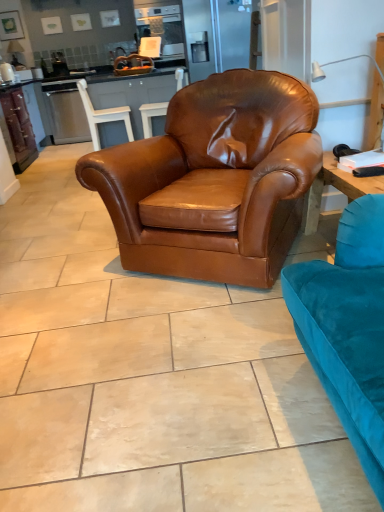
This screenshot has height=512, width=384. Identify the location of brown leather armchair at center, which is counted as the 1th chair, starting from the back. (151, 115).

Where is `satin silver oven at upper center`? This screenshot has height=512, width=384. satin silver oven at upper center is located at coordinates (162, 25).

Based on the photo, measure the distance between point (123, 113) and camera.

Point (123, 113) is 13.84 feet from camera.

This screenshot has height=512, width=384. I want to click on brown leather armchair at center, which is counted as the third chair, starting from the back, so click(x=214, y=180).

Locate an element on the screen. brown leather armchair at center, which is counted as the 3th chair, starting from the front is located at coordinates point(151,115).

Does brown leather armchair at center, which ranks as the 1th chair in front-to-back order, have a greater width compared to brown leather armchair at center, which is counted as the 3th chair, starting from the front?

Yes.

Is brown leather armchair at center, which is counted as the third chair, starting from the back, oriented towards brown leather armchair at center, which is counted as the 3th chair, starting from the front?

No, brown leather armchair at center, which is counted as the third chair, starting from the back, is not oriented towards brown leather armchair at center, which is counted as the 3th chair, starting from the front.

From the image's perspective, is brown leather armchair at center, which ranks as the 1th chair in front-to-back order, above or below brown leather armchair at center, which is counted as the 3th chair, starting from the front?

From the image's perspective, brown leather armchair at center, which ranks as the 1th chair in front-to-back order, appears below brown leather armchair at center, which is counted as the 3th chair, starting from the front.

How different are the orientations of brown leather armchair at center, which is counted as the third chair, starting from the back, and brown leather armchair at center, which is counted as the 1th chair, starting from the back, in degrees?

58.7 degrees.

Between satin silver oven at upper center and brown leather armchair at center, which ranks as the 1th chair in front-to-back order, which one has more height?

brown leather armchair at center, which ranks as the 1th chair in front-to-back order, is taller.

Measure the distance from satin silver oven at upper center to brown leather armchair at center, which is counted as the third chair, starting from the back.

satin silver oven at upper center is 4.10 meters away from brown leather armchair at center, which is counted as the third chair, starting from the back.

Is point (145, 32) farther from camera compared to point (198, 202)?

Yes, point (145, 32) is behind point (198, 202).

Considering the sizes of objects satin silver oven at upper center and brown leather armchair at center, which is counted as the third chair, starting from the back, in the image provided, who is wider, satin silver oven at upper center or brown leather armchair at center, which is counted as the third chair, starting from the back,?

brown leather armchair at center, which is counted as the third chair, starting from the back.

Is brown leather armchair at center, which ranks as the 1th chair in front-to-back order, thinner than brown leather armchair at center, the 2th chair viewed from the front?

In fact, brown leather armchair at center, which ranks as the 1th chair in front-to-back order, might be wider than brown leather armchair at center, the 2th chair viewed from the front.

From the picture: Does brown leather armchair at center, which is counted as the third chair, starting from the back, lie in front of brown leather armchair at center, which is the 2th chair in back-to-front order?

That is True.

Can you tell me how much brown leather armchair at center, which ranks as the 1th chair in front-to-back order, and brown leather armchair at center, which is the 2th chair in back-to-front order, differ in facing direction?

brown leather armchair at center, which ranks as the 1th chair in front-to-back order, and brown leather armchair at center, which is the 2th chair in back-to-front order, are facing 125 degrees away from each other.

Between brown leather armchair at center, which ranks as the 1th chair in front-to-back order, and brown leather armchair at center, the 2th chair viewed from the front, which one appears on the right side from the viewer's perspective?

Positioned to the right is brown leather armchair at center, which ranks as the 1th chair in front-to-back order.

Can you confirm if brown leather armchair at center, which is counted as the 1th chair, starting from the back, is wider than satin silver oven at upper center?

No.

Consider the image. Who is more distant, brown leather armchair at center, which is counted as the 3th chair, starting from the front, or satin silver oven at upper center?

satin silver oven at upper center is behind.

Is brown leather armchair at center, which is counted as the 3th chair, starting from the front, positioned beyond the bounds of satin silver oven at upper center?

Yes, brown leather armchair at center, which is counted as the 3th chair, starting from the front, is located beyond the bounds of satin silver oven at upper center.

Which is more distant, [144,127] or [178,24]?

The point [178,24] is farther from the camera.

Which is correct: brown leather armchair at center, which is the 2th chair in back-to-front order, is inside satin silver oven at upper center, or outside of it?

brown leather armchair at center, which is the 2th chair in back-to-front order, is spatially situated outside satin silver oven at upper center.

Are brown leather armchair at center, the 2th chair viewed from the front, and satin silver oven at upper center located far from each other?

Yes.

Is brown leather armchair at center, the 2th chair viewed from the front, oriented towards satin silver oven at upper center?

No, brown leather armchair at center, the 2th chair viewed from the front, is not facing towards satin silver oven at upper center.

Is brown leather armchair at center, which is counted as the 1th chair, starting from the back, next to brown leather armchair at center, which is counted as the third chair, starting from the back?

No, brown leather armchair at center, which is counted as the 1th chair, starting from the back, is not in contact with brown leather armchair at center, which is counted as the third chair, starting from the back.

Is point (165, 106) farther from viewer compared to point (200, 113)?

Yes, it is behind point (200, 113).

Which object is positioned more to the right, brown leather armchair at center, which is counted as the 3th chair, starting from the front, or brown leather armchair at center, which is counted as the third chair, starting from the back?

brown leather armchair at center, which is counted as the third chair, starting from the back, is more to the right.

From a real-world perspective, who is located higher, brown leather armchair at center, which is counted as the 1th chair, starting from the back, or brown leather armchair at center, which ranks as the 1th chair in front-to-back order?

From a 3D spatial view, brown leather armchair at center, which is counted as the 1th chair, starting from the back, is above.

Between point (178, 26) and point (93, 131), which one is positioned in front?

The point (93, 131) is more forward.

Which of these two, satin silver oven at upper center or brown leather armchair at center, the 2th chair viewed from the front, is wider?

satin silver oven at upper center.

From a real-world perspective, is satin silver oven at upper center on top of brown leather armchair at center, which is the 2th chair in back-to-front order?

Yes, from a real-world perspective, satin silver oven at upper center is over brown leather armchair at center, which is the 2th chair in back-to-front order

You are a GUI agent. You are given a task and a screenshot of the screen. Output one action in this format:
    pyautogui.click(x=<x>, y=<y>)
    Task: Click on the 2nd chair positioned below the brown leather armchair at center, which is counted as the 1th chair, starting from the back (from the image's perspective)
    The width and height of the screenshot is (384, 512).
    Given the screenshot: What is the action you would take?
    pyautogui.click(x=214, y=180)

From a real-world perspective, starting from the satin silver oven at upper center, which chair is the 3rd one below it? Please provide its 2D coordinates.

[(214, 180)]

Considering their positions, is satin silver oven at upper center positioned closer to brown leather armchair at center, which ranks as the 1th chair in front-to-back order, than brown leather armchair at center, the 2th chair viewed from the front?

The object closer to brown leather armchair at center, which ranks as the 1th chair in front-to-back order, is brown leather armchair at center, the 2th chair viewed from the front.

Looking at the image, which one is located closer to satin silver oven at upper center, brown leather armchair at center, which is counted as the 3th chair, starting from the front, or brown leather armchair at center, the 2th chair viewed from the front?

brown leather armchair at center, which is counted as the 3th chair, starting from the front, lies closer to satin silver oven at upper center than the other object.

From the image, which object appears to be farther from brown leather armchair at center, which is the 2th chair in back-to-front order, brown leather armchair at center, which is counted as the 1th chair, starting from the back, or satin silver oven at upper center?

satin silver oven at upper center is positioned further to the anchor brown leather armchair at center, which is the 2th chair in back-to-front order.

Based on their spatial positions, is brown leather armchair at center, which ranks as the 1th chair in front-to-back order, or satin silver oven at upper center closer to brown leather armchair at center, which is counted as the 1th chair, starting from the back?

Among the two, satin silver oven at upper center is located nearer to brown leather armchair at center, which is counted as the 1th chair, starting from the back.

From the picture: Considering their positions, is brown leather armchair at center, which ranks as the 1th chair in front-to-back order, positioned further to brown leather armchair at center, the 2th chair viewed from the front, than brown leather armchair at center, which is counted as the 3th chair, starting from the front?

brown leather armchair at center, which ranks as the 1th chair in front-to-back order, is further to brown leather armchair at center, the 2th chair viewed from the front.

Estimate the real-world distances between objects in this image. Which object is closer to satin silver oven at upper center, brown leather armchair at center, which is counted as the third chair, starting from the back, or brown leather armchair at center, which is counted as the 3th chair, starting from the front?

brown leather armchair at center, which is counted as the 3th chair, starting from the front.

Based on their spatial positions, is brown leather armchair at center, which is counted as the 3th chair, starting from the front, or brown leather armchair at center, which is the 2th chair in back-to-front order, further from brown leather armchair at center, which is counted as the third chair, starting from the back?

Based on the image, brown leather armchair at center, which is the 2th chair in back-to-front order, appears to be further to brown leather armchair at center, which is counted as the third chair, starting from the back.

Which object lies further to the anchor point satin silver oven at upper center, brown leather armchair at center, which is counted as the third chair, starting from the back, or brown leather armchair at center, the 2th chair viewed from the front?

Among the two, brown leather armchair at center, which is counted as the third chair, starting from the back, is located further to satin silver oven at upper center.

You are a GUI agent. You are given a task and a screenshot of the screen. Output one action in this format:
    pyautogui.click(x=<x>, y=<y>)
    Task: Click on the chair between brown leather armchair at center, which ranks as the 1th chair in front-to-back order, and brown leather armchair at center, which is counted as the 3th chair, starting from the front, along the z-axis
    The height and width of the screenshot is (512, 384).
    Given the screenshot: What is the action you would take?
    pyautogui.click(x=103, y=116)

This screenshot has height=512, width=384. What are the coordinates of `chair between brown leather armchair at center, which is the 2th chair in back-to-front order, and satin silver oven at upper center from front to back` in the screenshot? It's located at (151, 115).